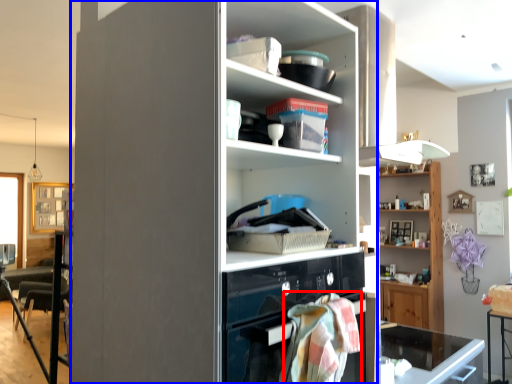
Question: Which object appears closest to the camera in this image, blanket (highlighted by a red box) or cupboard (highlighted by a blue box)?

Choices:
 (A) blanket
 (B) cupboard

Answer: (B)